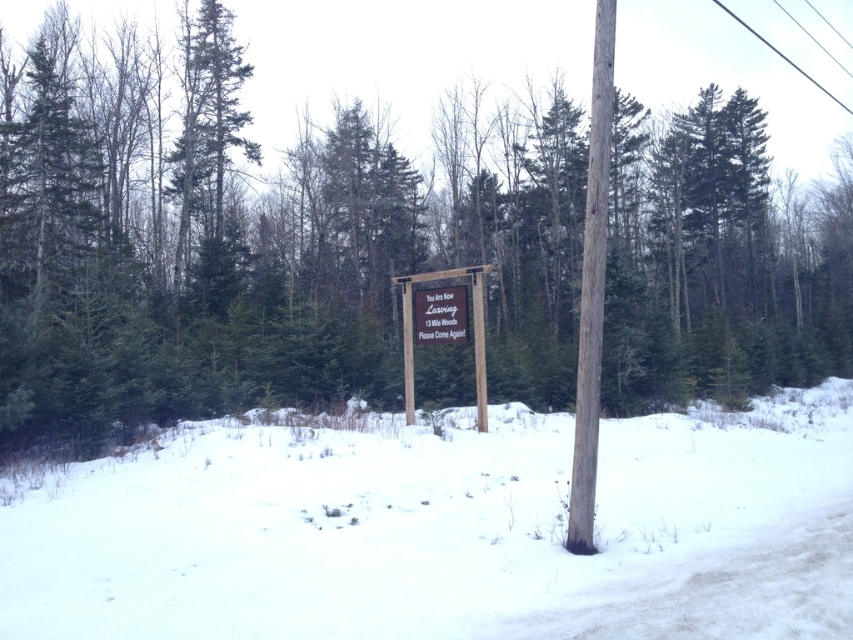
You are a delivery robot with a 1 meter wide package. You need to pass through the area between the white fluffy snow at lower center and the metallic silver sign at center. Can your package fit through the space between them?

The white fluffy snow at lower center is wider than the metallic silver sign at center. Therefore, the space between them is sufficient to accommodate a 1 meter wide package, so yes, it can fit through.

You are a delivery robot trying to navigate through the snow. You need to deliver a package to the signboard. Since the snow is deep, you can only move where there is no snow. Based on the image, can you reach the brown wooden sign at center without stepping on the white fluffy snow at lower center?

The white fluffy snow at lower center is positioned under the brown wooden sign at center, so the robot cannot reach the sign without stepping on the snow since the snow is directly beneath it.